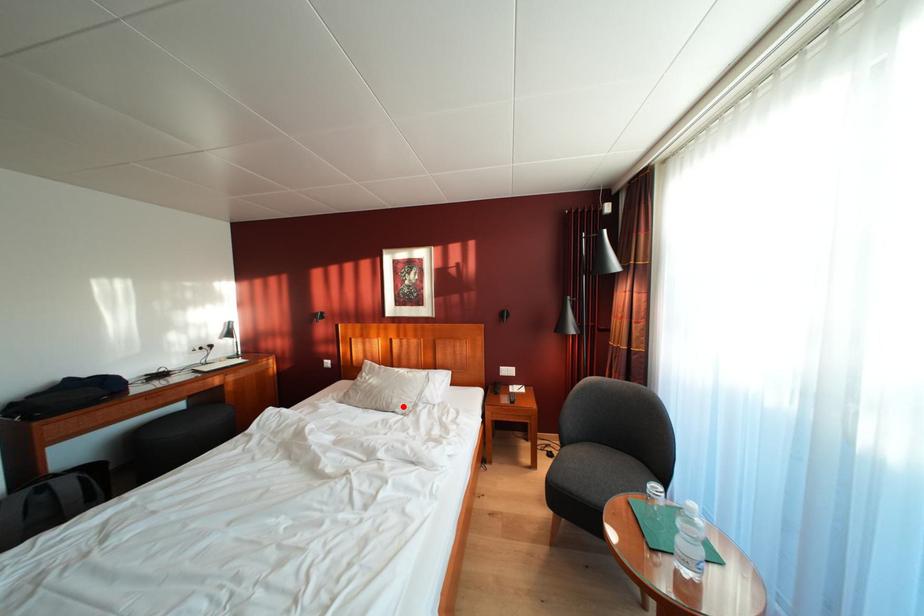
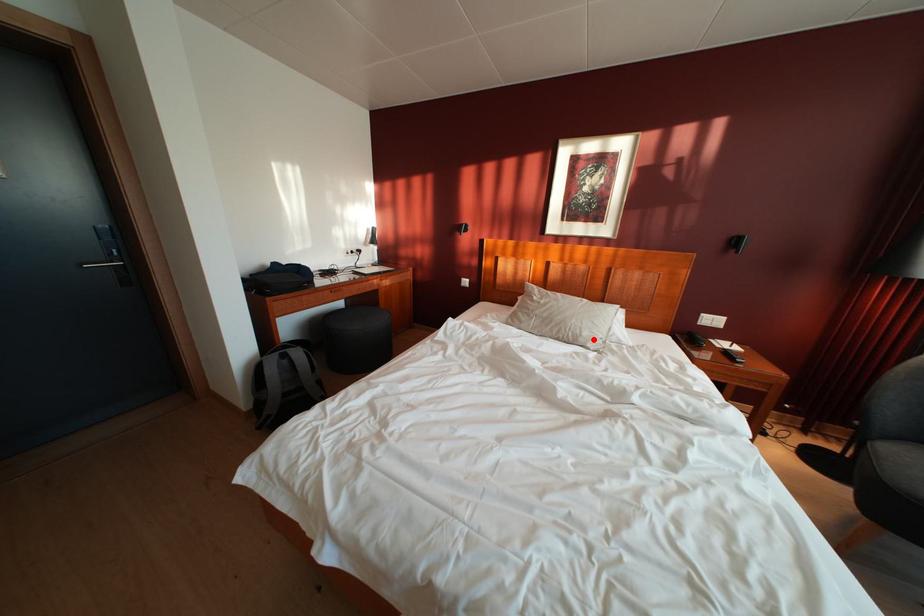
I am providing you with two images of the same scene from different viewpoints. A red point is marked on the first image and another point is marked on the second image. Do the highlighted points in image1 and image2 indicate the same real-world spot?

Yes